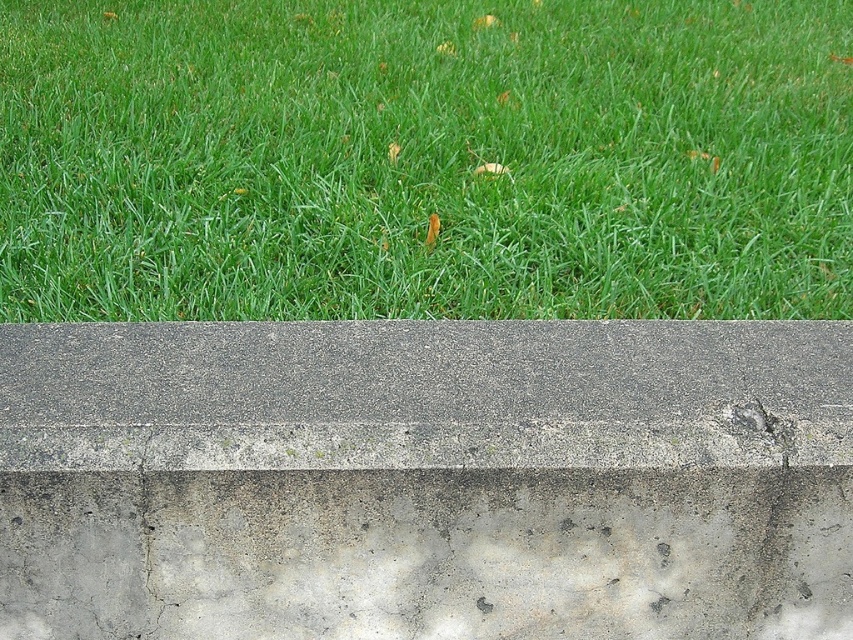
You are standing at the point marked as point (x=1, y=573) near the curb. You want to throw a small pebble to hit a target 3 meters away from you. Will you be able to reach the target with one throw?

The distance between you and the target is 3 meters. Since the point (x=1, y=573) is 2.09 meters away from the viewer, you can reach the target with one throw as 3 meters is within a typical throwing distance.

You are a gardener trying to place a new flower pot that requires 1 meter of space. You see the gray concrete bench at bottom and the gray concrete at center. Which area can accommodate the flower pot?

The gray concrete at center can accommodate the flower pot since its width is greater than the gray concrete bench at bottom.

You are standing in a park and see the green grass at upper and the gray concrete bench at bottom. Which object is closer to you?

The green grass at upper is closer to you because it is further to the viewer than the gray concrete bench at bottom.